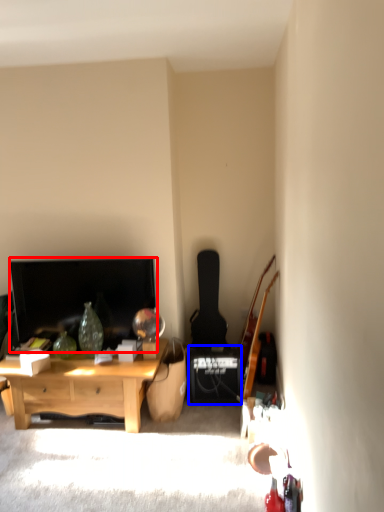
Question: Which point is closer to the camera, television (highlighted by a red box) or speaker (highlighted by a blue box)?

Choices:
 (A) television
 (B) speaker

Answer: (A)